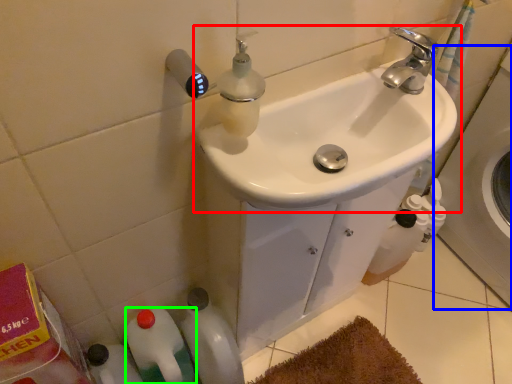
Question: Based on their relative distances, which object is farther from sink (highlighted by a red box)? Choose from bath (highlighted by a blue box) and bottle (highlighted by a green box).

Choices:
 (A) bath
 (B) bottle

Answer: (A)